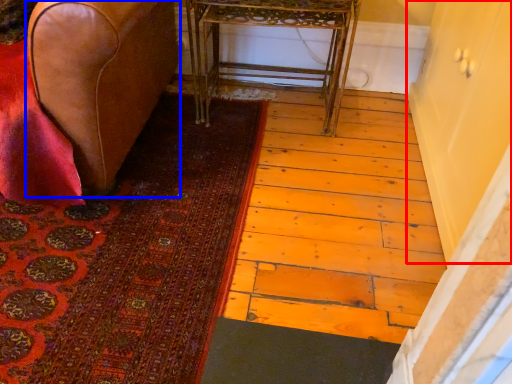
Question: Among these objects, which one is nearest to the camera, screen door (highlighted by a red box) or furniture (highlighted by a blue box)?

Choices:
 (A) screen door
 (B) furniture

Answer: (A)